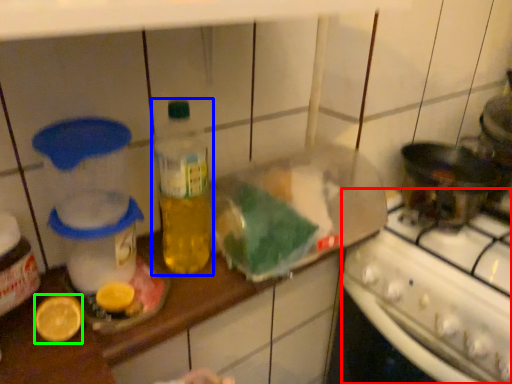
Question: Which object is the closest to the stove (highlighted by a red box)? Choose among these: bottle (highlighted by a blue box) or lemon (highlighted by a green box).

Choices:
 (A) bottle
 (B) lemon

Answer: (A)